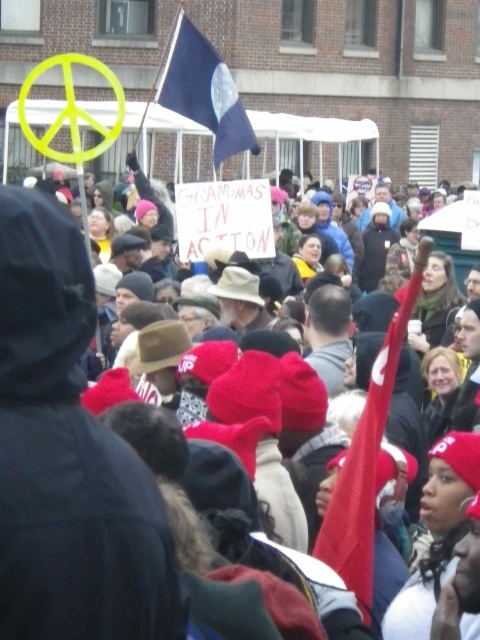
You are a photographer taking a picture of the protest scene. You have two points of interest marked in your viewfinder at coordinates point (389, 339) and point (219, 145). Which point is closer to your camera lens?

Point (389, 339) is closer to the camera lens than point (219, 145).

You are a photographer at the protest and want to capture both the red fabric flag at center and the blue fabric flag at upper center in a single frame. Based on their positions, which flag should you position first in your camera viewfinder to ensure both are visible?

The red fabric flag at center is to the right of the blue fabric flag at upper center, so you should position the blue fabric flag at upper center first in your camera viewfinder to ensure both are visible.

You are standing at the camera position and want to know how far the point at coordinates (330, 560) is from you. Can you determine the distance?

The point at coordinates (330, 560) is 24.57 meters away from the camera position.